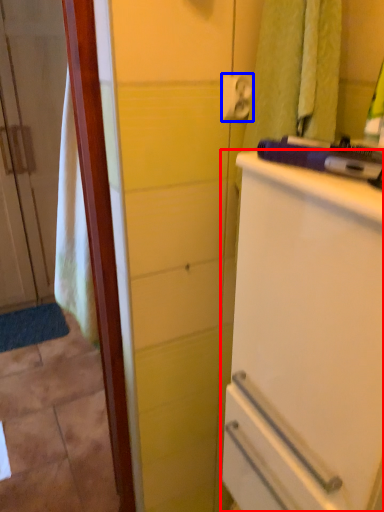
Question: Among these objects, which one is nearest to the camera, refrigerator (highlighted by a red box) or towel bar (highlighted by a blue box)?

Choices:
 (A) refrigerator
 (B) towel bar

Answer: (A)